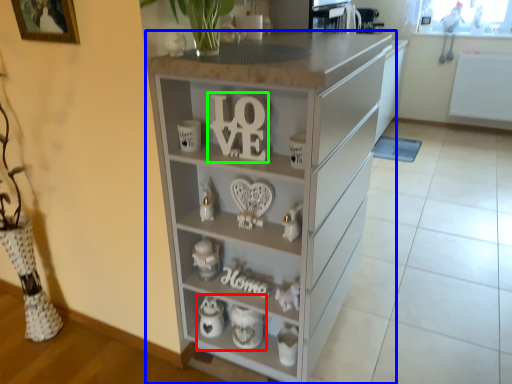
Question: Which is nearer to the tea set (highlighted by a red box)? chest of drawers (highlighted by a blue box) or alphabet (highlighted by a green box).

Choices:
 (A) chest of drawers
 (B) alphabet

Answer: (A)